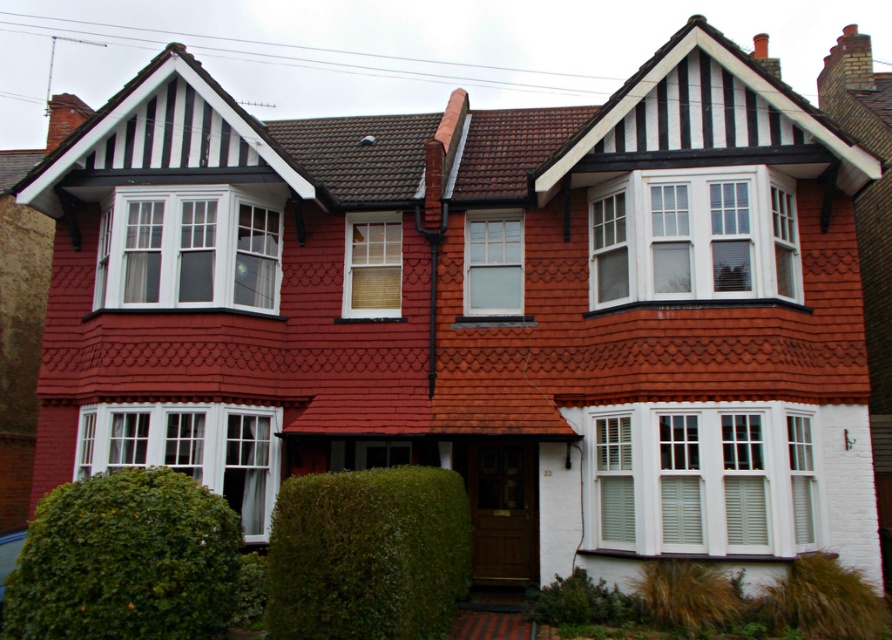
Question: Which of the following is the farthest from the observer?

Choices:
 (A) (614, 230)
 (B) (675, 186)
 (C) (624, 424)

Answer: (A)

Question: Is wooden blinds at center to the left of white wood shutter at right from the viewer's perspective?

Choices:
 (A) yes
 (B) no

Answer: (A)

Question: Which is nearer to the white wood window at lower left?

Choices:
 (A) white wooden shutter at upper center
 (B) white wood shutter at right

Answer: (A)

Question: Can you confirm if white painted wood shutters at center is positioned above white wood window at lower left?

Choices:
 (A) no
 (B) yes

Answer: (A)

Question: Which of these objects is positioned closest to the green leafy hedge at center?

Choices:
 (A) white painted wood shutter at lower right
 (B) white wood shutter at upper right
 (C) white painted wood shutters at center

Answer: (C)

Question: Does white wood window at lower left have a greater width compared to white wooden shutter at upper right?

Choices:
 (A) yes
 (B) no

Answer: (A)